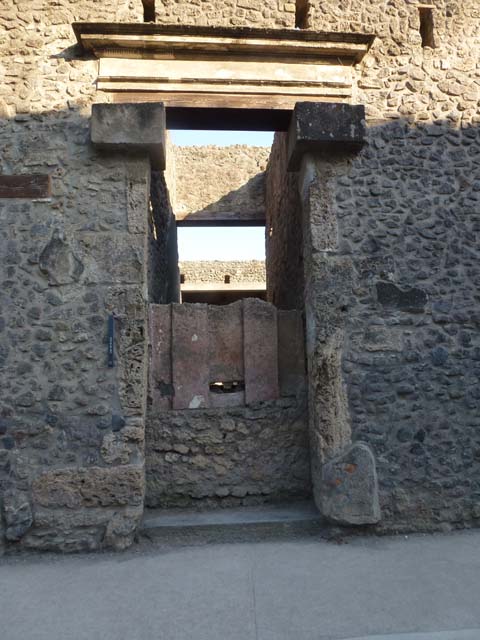
Where is `cornice above opening`? Image resolution: width=480 pixels, height=640 pixels. cornice above opening is located at coordinates (256, 61).